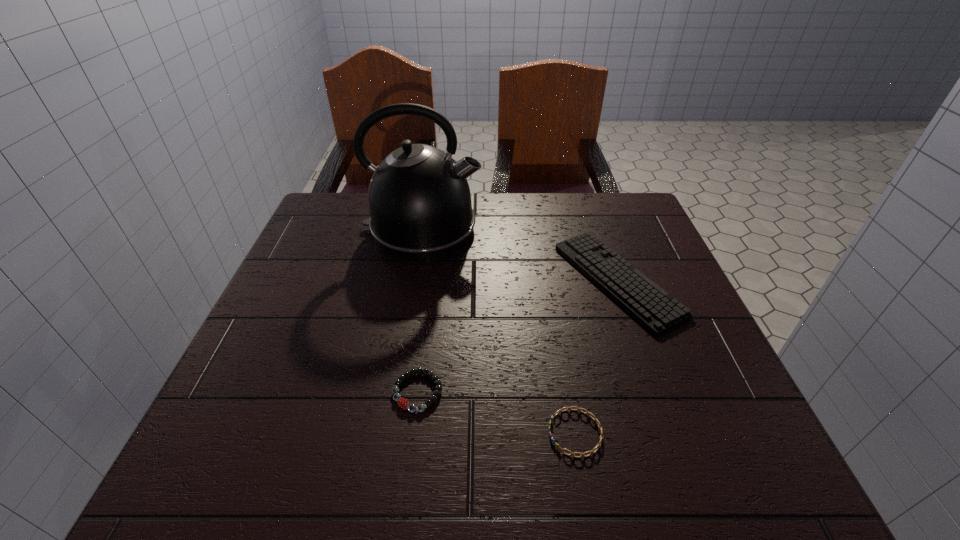
This screenshot has height=540, width=960. Identify the location of free region at the near edge of the desktop. (356, 431).

This screenshot has height=540, width=960. I want to click on free space at the left edge, so click(x=295, y=415).

Find the location of a particular element. Image resolution: width=960 pixels, height=540 pixels. free space at the right edge of the desktop is located at coordinates (717, 357).

Locate an element on the screen. This screenshot has width=960, height=540. vacant region at the far left corner is located at coordinates (324, 235).

The width and height of the screenshot is (960, 540). I want to click on free space at the far right corner of the desktop, so click(x=625, y=197).

The height and width of the screenshot is (540, 960). I want to click on blank space at the near right corner of the desktop, so click(740, 478).

At what (x,y) coordinates should I click in order to perform the action: click on free space that is in between the computer keyboard and the left bracelet. Please return your answer as a coordinate pair (x, y). The height and width of the screenshot is (540, 960). Looking at the image, I should click on (517, 336).

The image size is (960, 540). Find the location of `vacant space that is in between the third shortest object and the right bracelet`. vacant space that is in between the third shortest object and the right bracelet is located at coordinates (596, 356).

Where is `free space between the tallest object and the right bracelet`? This screenshot has width=960, height=540. free space between the tallest object and the right bracelet is located at coordinates (499, 331).

This screenshot has width=960, height=540. Identify the location of empty location between the computer keyboard and the left bracelet. (517, 336).